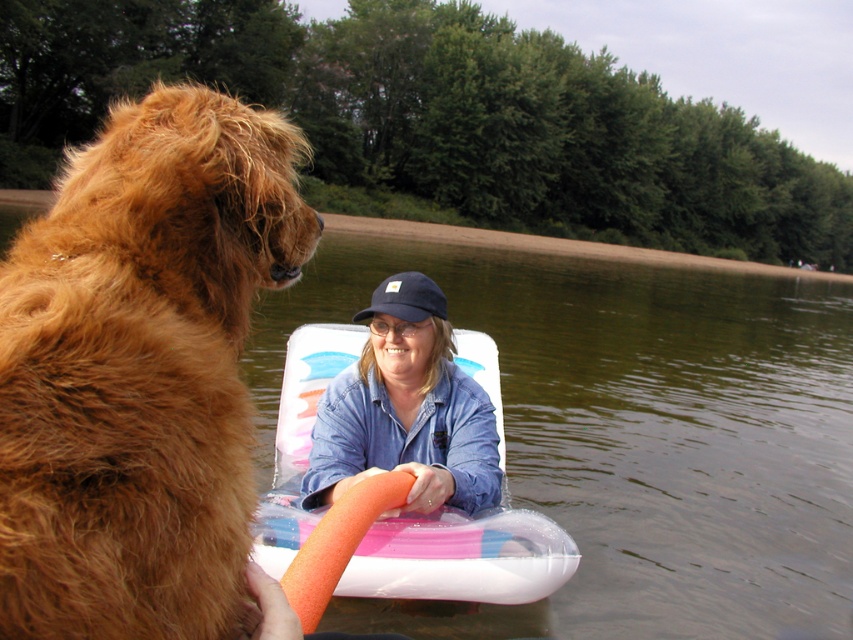
Question: Observing the image, what is the correct spatial positioning of golden fur dog at left in reference to translucent plastic raft at center?

Choices:
 (A) left
 (B) right

Answer: (A)

Question: Which is farther from the golden fur dog at left?

Choices:
 (A) blue denim jacket at center
 (B) blue fabric baseball cap at center
 (C) translucent plastic raft at center

Answer: (C)

Question: Does golden fur dog at left appear on the left side of translucent plastic raft at center?

Choices:
 (A) yes
 (B) no

Answer: (A)

Question: Which of these objects is positioned closest to the blue denim jacket at center?

Choices:
 (A) translucent plastic raft at center
 (B) clear water at center
 (C) golden fur dog at left
 (D) blue fabric baseball cap at center

Answer: (A)

Question: Which point appears farthest from the camera in this image?

Choices:
 (A) (415, 396)
 (B) (422, 300)

Answer: (A)

Question: Considering the relative positions of clear water at center and translucent plastic raft at center in the image provided, where is clear water at center located with respect to translucent plastic raft at center?

Choices:
 (A) left
 (B) right

Answer: (B)